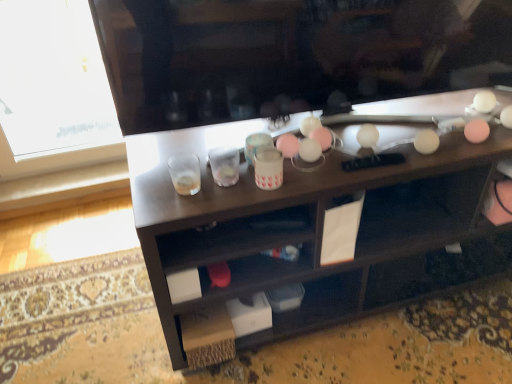
Find the location of a particular element. The width and height of the screenshot is (512, 384). free space to the left of clear plastic shot glass at center, which is counted as the 2th shot glass, starting from the left is located at coordinates (166, 178).